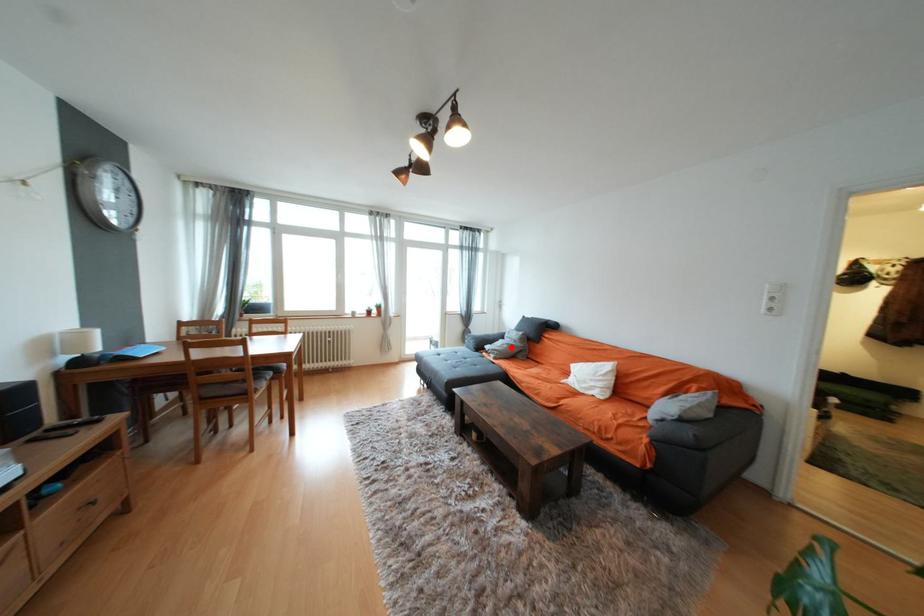
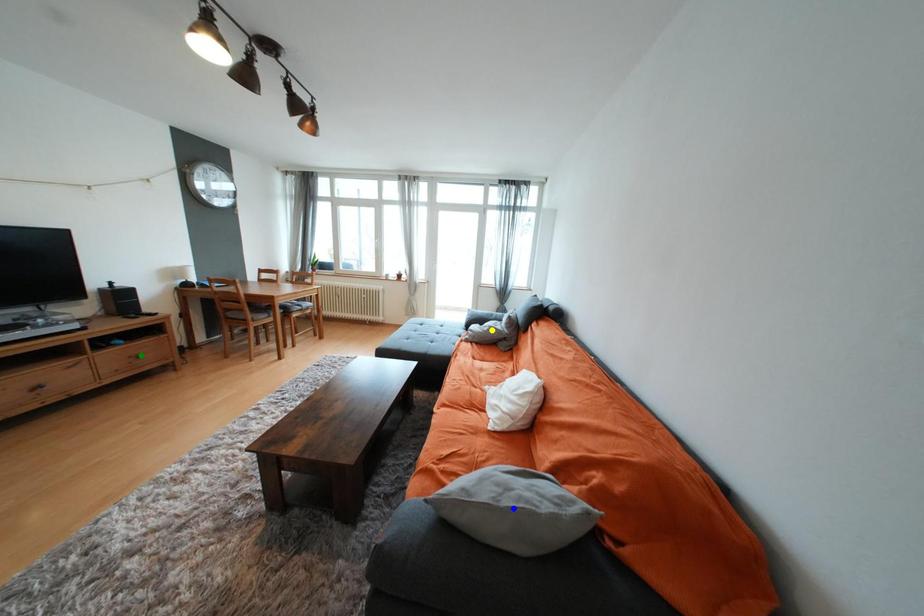
Question: I am providing you with two images of the same scene from different viewpoints. A red point is marked on the first image. You are given multiple points on the second image. In image 2, which mark is for the same physical point as the one in image 1?

Choices:
 (A) yellow point
 (B) blue point
 (C) green point

Answer: (A)